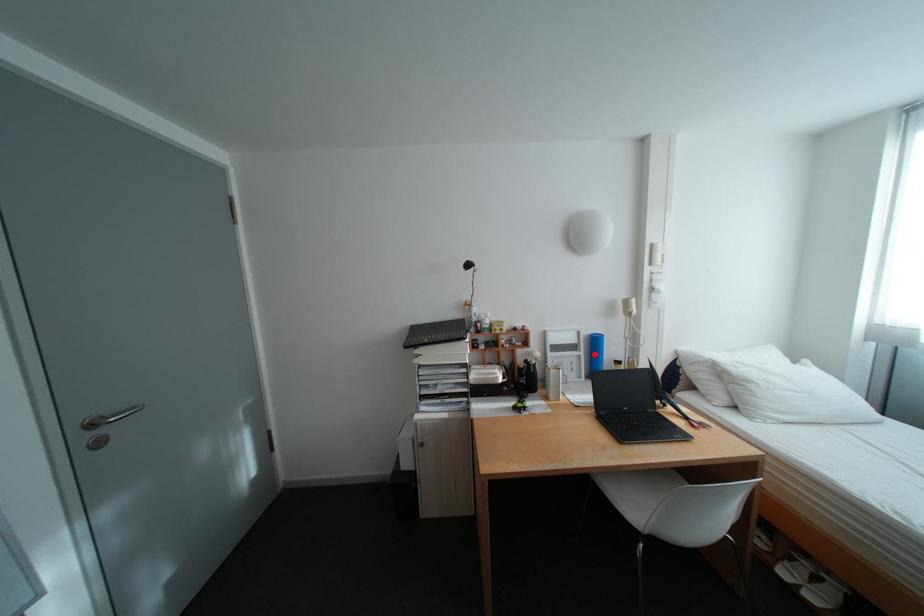
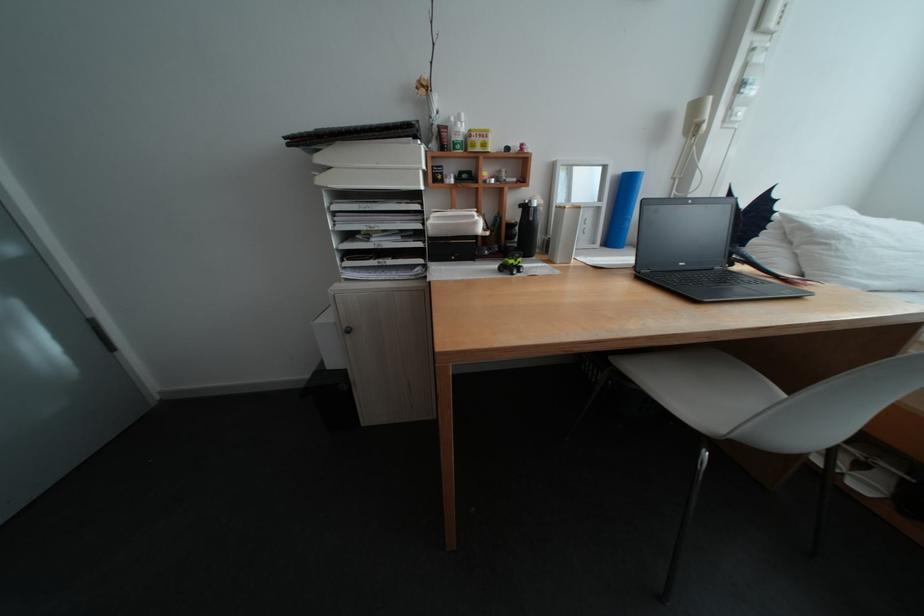
Question: I am providing you with two images of the same scene from different viewpoints. In image1, a red point is highlighted. Considering the same 3D point in image2, which of the following is correct?

Choices:
 (A) It is closer
 (B) It is farther

Answer: (A)